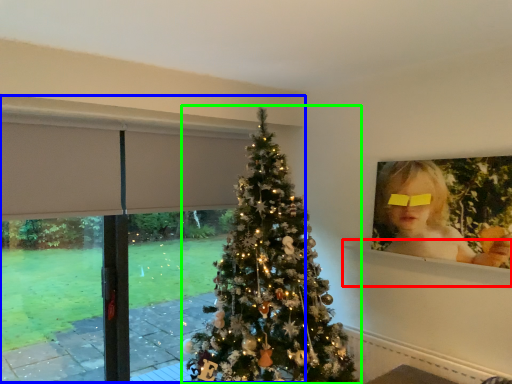
Question: Estimate the real-world distances between objects in this image. Which object is closer to window sill (highlighted by a red box), window frame (highlighted by a blue box) or christmas tree (highlighted by a green box)?

Choices:
 (A) window frame
 (B) christmas tree

Answer: (B)